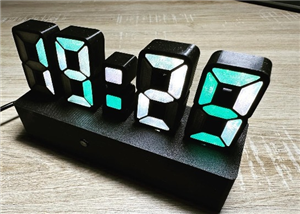
This screenshot has height=214, width=300. I want to click on wooden surface, so click(117, 194).